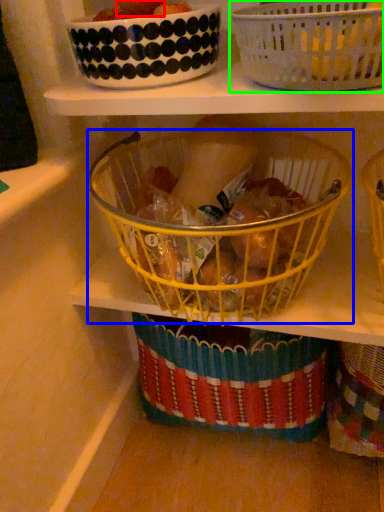
Question: Based on their relative distances, which object is nearer to fruit (highlighted by a red box)? Choose from basket (highlighted by a blue box) and basket (highlighted by a green box).

Choices:
 (A) basket
 (B) basket

Answer: (B)